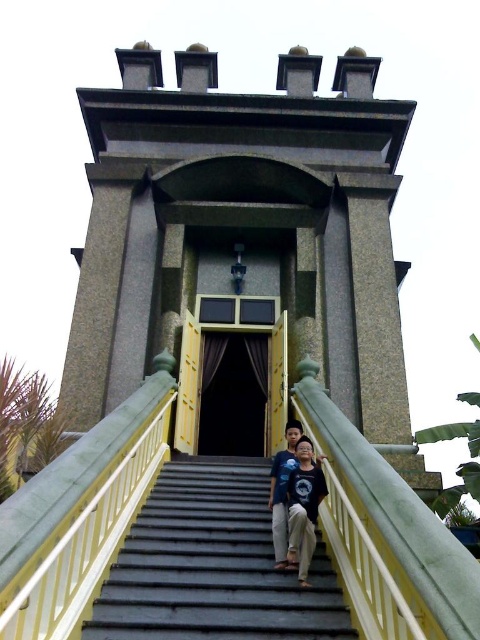
What do you see at coordinates (213, 564) in the screenshot? Image resolution: width=480 pixels, height=640 pixels. I see `smooth concrete stairs at center` at bounding box center [213, 564].

Is smooth concrete stairs at center wider than blue denim shirt at center?

Yes, smooth concrete stairs at center is wider than blue denim shirt at center.

Image resolution: width=480 pixels, height=640 pixels. In order to click on smooth concrete stairs at center in this screenshot , I will do `click(213, 564)`.

In order to click on smooth concrete stairs at center in this screenshot , I will do `click(213, 564)`.